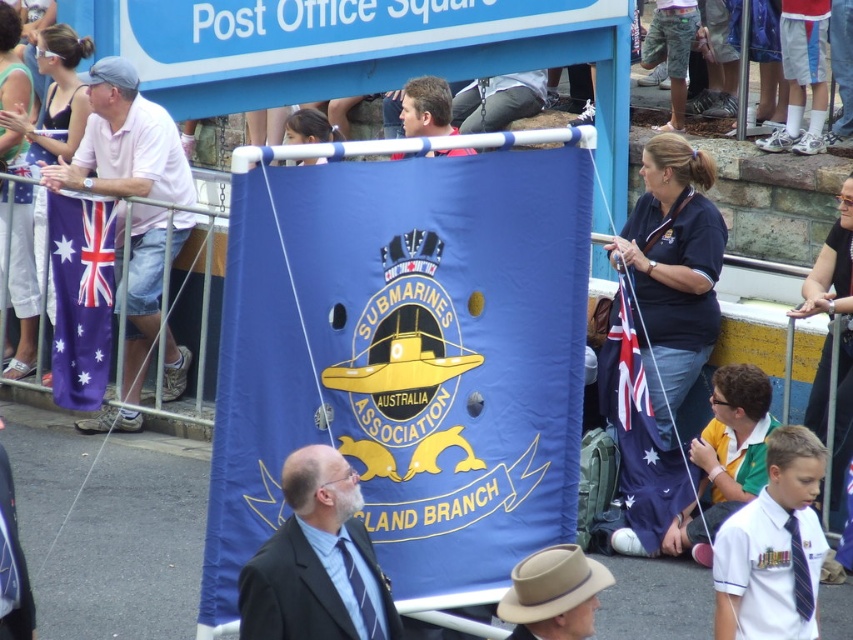
You are a photographer at the event and want to capture the blue banner being carried by the group. You notice a point at coordinates point (125, 144). What object is this point located on?

The point (125, 144) is on the white cotton shirt at left.

Based on the photo, you are a photographer positioned at the front of the crowd capturing the event. You notice the white cotton shirt at left and the blue fabric flag at center. Which object is closer to your camera lens?

The white cotton shirt at left is closer to the camera lens because it is further to the viewer than the blue fabric flag at center.

You are standing in the crowd watching the Submarines Australia Association parade. You notice two points marked in the scene. Which point is closer to you, point (282, 557) or point (636, 346)?

Point (282, 557) is closer to you than point (636, 346).